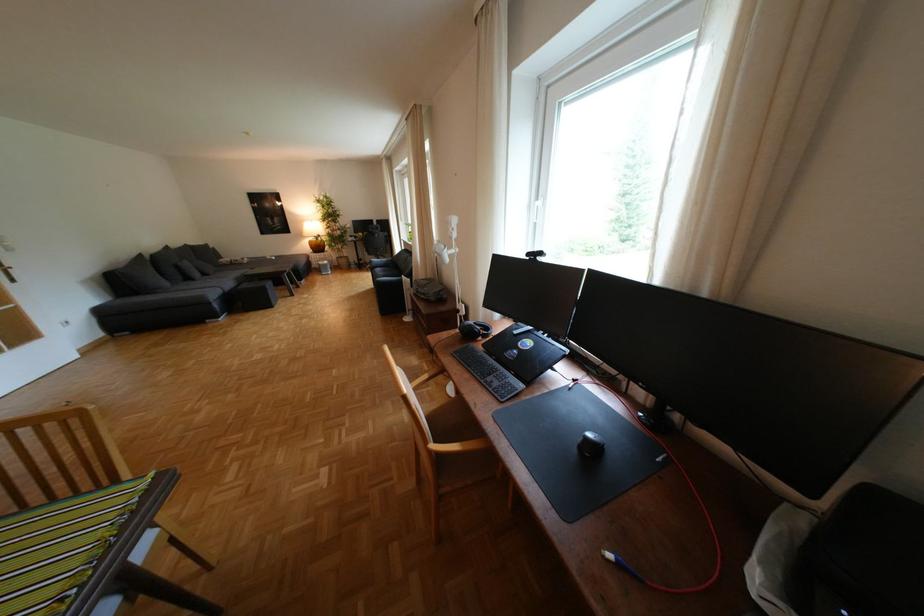
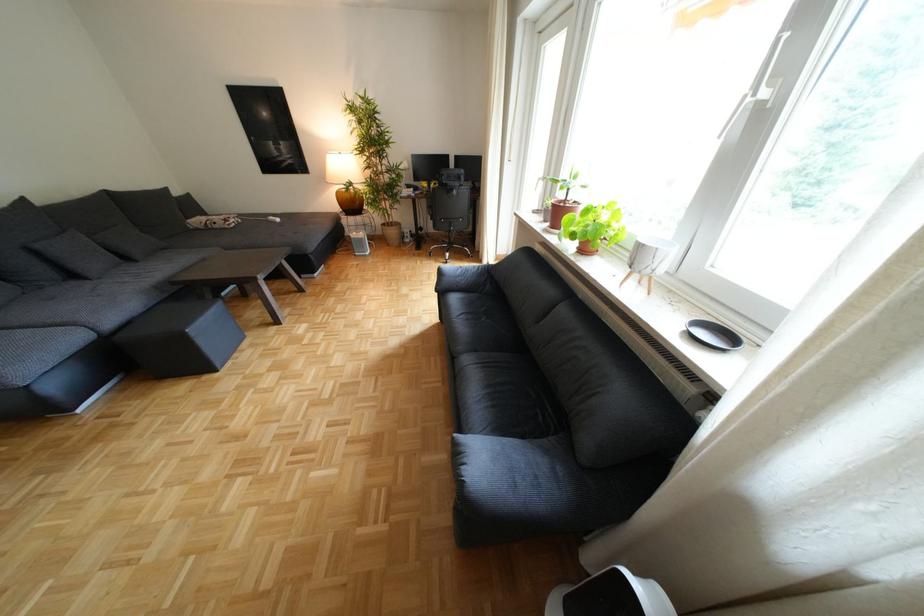
Where in the second image is the point corresponding to [322,241] from the first image?

(351, 193)